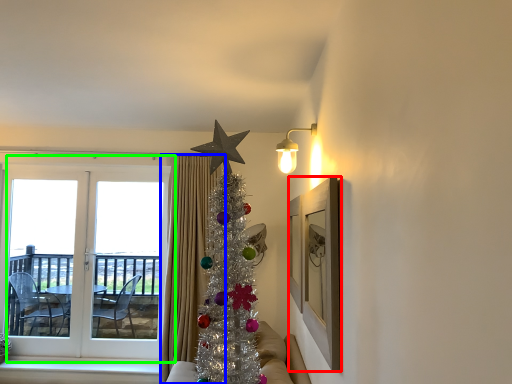
Question: Which object is the closest to the picture frame (highlighted by a red box)? Choose among these: curtain (highlighted by a blue box) or window (highlighted by a green box).

Choices:
 (A) curtain
 (B) window

Answer: (A)